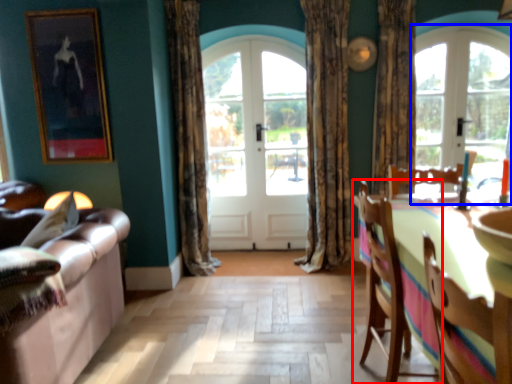
Question: Which object is further to the camera taking this photo, chair (highlighted by a red box) or window (highlighted by a blue box)?

Choices:
 (A) chair
 (B) window

Answer: (B)